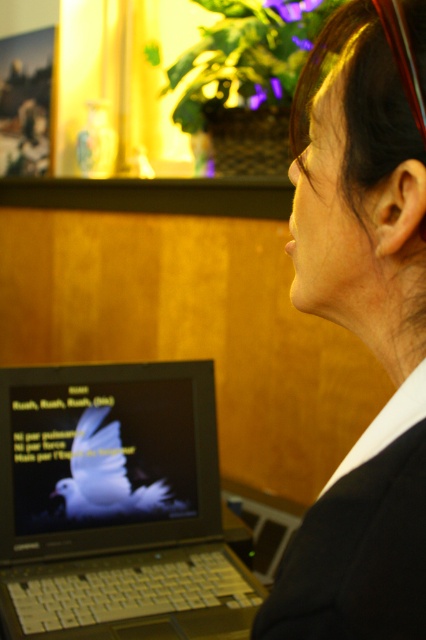
Measure the distance between matte black laptop at center and white matte bird at center.

The distance of matte black laptop at center from white matte bird at center is 2.94 inches.

What do you see at coordinates (115, 506) in the screenshot?
I see `matte black laptop at center` at bounding box center [115, 506].

At what (x,y) coordinates should I click in order to perform the action: click on matte black laptop at center. Please return your answer as a coordinate pair (x, y). Looking at the image, I should click on (115, 506).

The height and width of the screenshot is (640, 426). What are the coordinates of `matte black laptop at center` in the screenshot? It's located at click(x=115, y=506).

Between matte black laptop at center and black fabric business suit at lower right, which one appears on the left side from the viewer's perspective?

Positioned to the left is matte black laptop at center.

Does matte black laptop at center have a lesser width compared to black fabric business suit at lower right?

No, matte black laptop at center is not thinner than black fabric business suit at lower right.

This screenshot has height=640, width=426. I want to click on matte black laptop at center, so click(x=115, y=506).

Can you confirm if black fabric at center is positioned above matte black laptop at center?

Correct, black fabric at center is located above matte black laptop at center.

Who is higher up, black fabric at center or matte black laptop at center?

black fabric at center is above.

Who is more forward, (396, 372) or (71, 580)?

Point (396, 372) is in front.

Identify the location of black fabric at center. This screenshot has height=640, width=426. (359, 337).